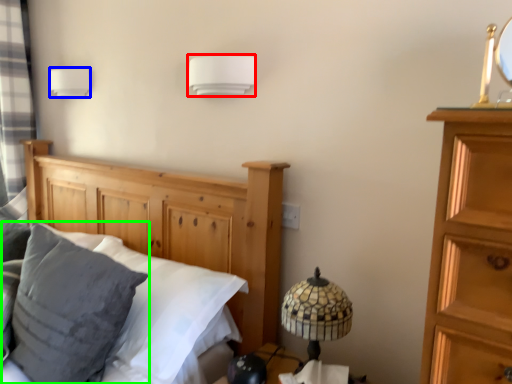
Question: Which object is the farthest from lamp (highlighted by a red box)? Choose among these: lamp (highlighted by a blue box) or pillow (highlighted by a green box).

Choices:
 (A) lamp
 (B) pillow

Answer: (A)